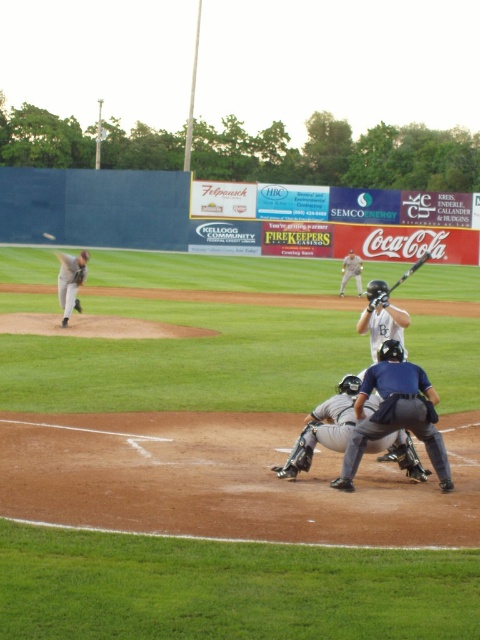
You are a player on the field and need to retrieve your black matte bat at center. There is a blue fabric umpire at center in your path. Which direction should you move to avoid the umpire and reach your bat?

The blue fabric umpire at center is to the left of the black matte bat at center, so you should move to the right to avoid the umpire and reach your bat.

You are a spectator at the baseball game and want to take a photo of the blue fabric umpire at center and the white matte baseball at center. Which one should you focus on first if you want to capture both in the same frame without moving the camera?

The blue fabric umpire at center is located below the white matte baseball at center, so you should focus on the umpire first to ensure both are in the frame.

You are a player on the field and need to retrieve the white matte baseball at center. There is an obstruction blocking your path to the left. Which direction should you go around to avoid the blue fabric umpire at center?

The blue fabric umpire at center is on the right side of the white matte baseball at center, so you should go around to the left side to avoid the umpire.